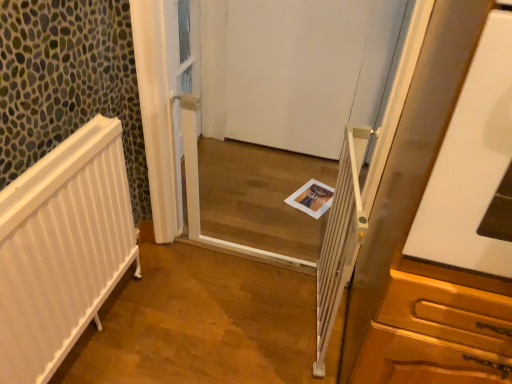
Where is `vacant space in front of white paper magazine at center`? The height and width of the screenshot is (384, 512). vacant space in front of white paper magazine at center is located at coordinates (295, 223).